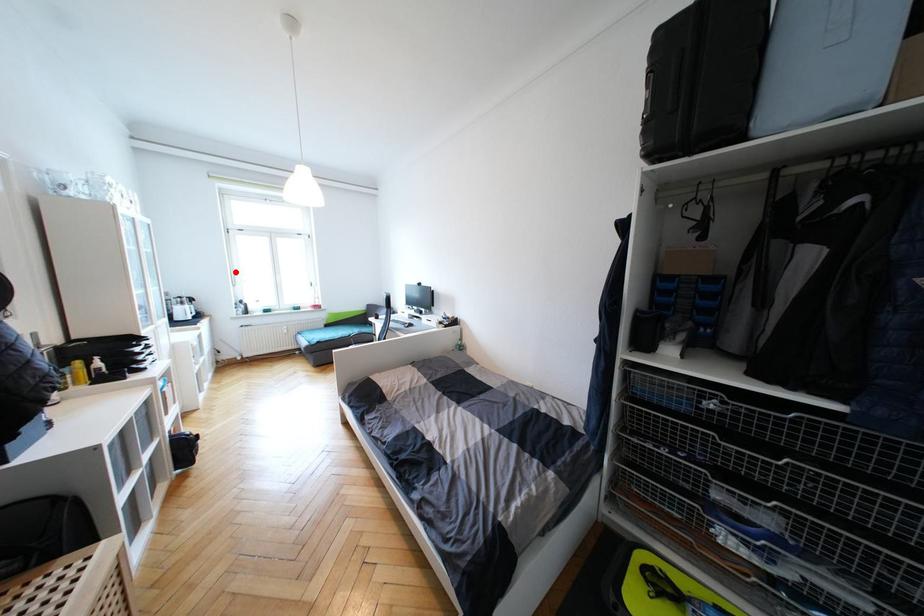
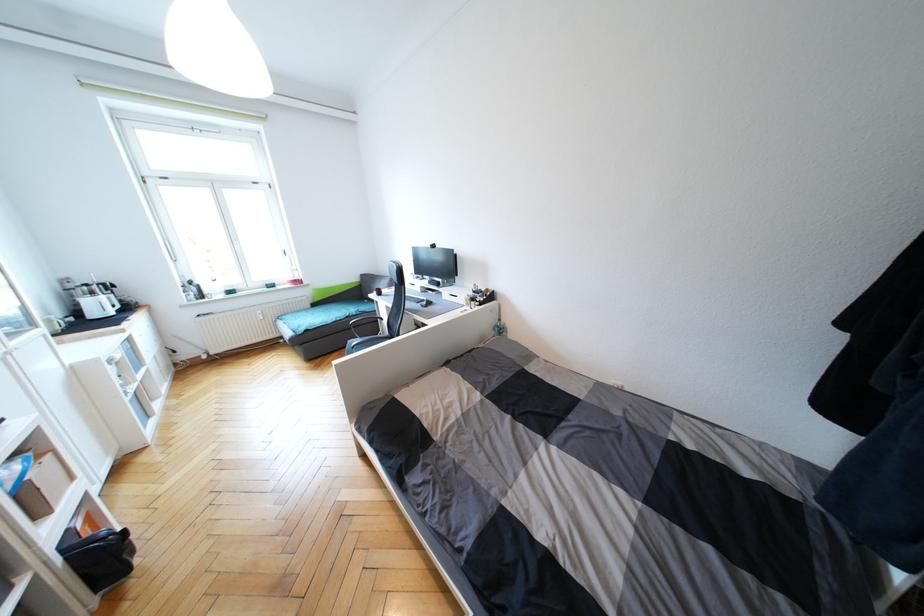
Where in the second image is the point corresponding to the highlighted location from the first image?

(169, 241)